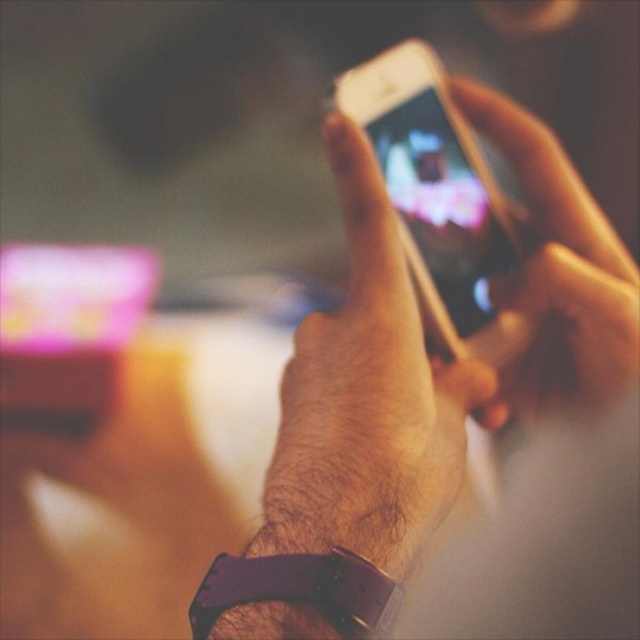
Question: Which of the following is the closest to the observer?

Choices:
 (A) metallic gold phone at center
 (B) matte skin hand at center

Answer: (A)

Question: Observing the image, what is the correct spatial positioning of metallic gold phone at center in reference to matte skin hand at center?

Choices:
 (A) above
 (B) below

Answer: (A)

Question: Which of the following is the farthest from the observer?

Choices:
 (A) metallic gold phone at center
 (B) matte skin hand at center

Answer: (B)

Question: In this image, where is metallic gold phone at center located relative to matte skin hand at center?

Choices:
 (A) above
 (B) below

Answer: (A)

Question: Can you confirm if metallic gold phone at center is positioned to the right of matte skin hand at center?

Choices:
 (A) no
 (B) yes

Answer: (A)